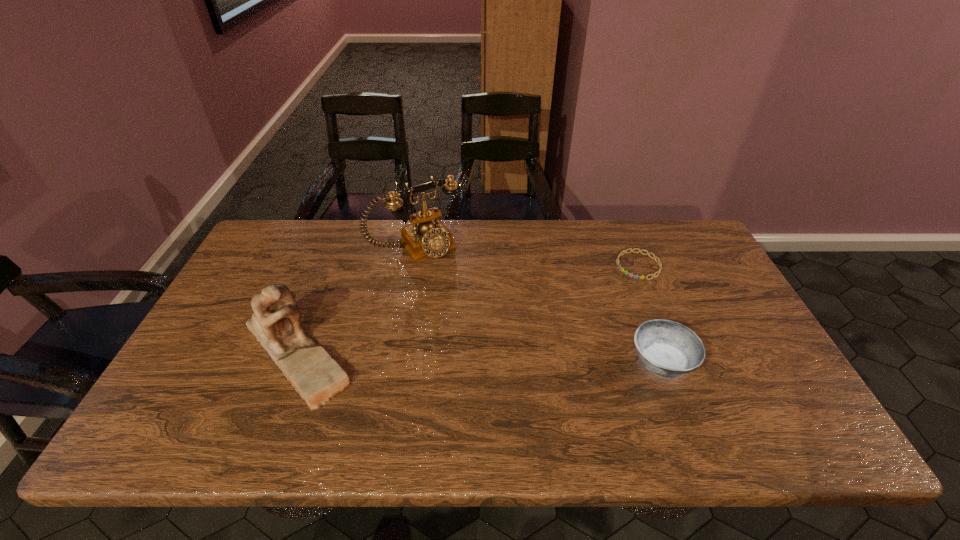
Find the location of a particular element. This screenshot has width=960, height=540. free area in between the telephone and the shortest object is located at coordinates (527, 255).

You are a GUI agent. You are given a task and a screenshot of the screen. Output one action in this format:
    pyautogui.click(x=<x>, y=<y>)
    Task: Click on the free spot between the ashtray and the figurine
    The height and width of the screenshot is (540, 960).
    Given the screenshot: What is the action you would take?
    pos(479,356)

In order to click on free space between the figurine and the telephone in this screenshot , I will do `click(356, 298)`.

The width and height of the screenshot is (960, 540). I want to click on free space between the telephone and the third tallest object, so click(539, 304).

This screenshot has width=960, height=540. Identify the location of vacant area that lies between the shortest object and the telephone. (527, 255).

Identify the location of vacant space that is in between the telephone and the bracelet. The image size is (960, 540). (527, 255).

You are a GUI agent. You are given a task and a screenshot of the screen. Output one action in this format:
    pyautogui.click(x=<x>, y=<y>)
    Task: Click on the free space between the bracelet and the figurine
    Image resolution: width=960 pixels, height=540 pixels.
    Given the screenshot: What is the action you would take?
    pyautogui.click(x=468, y=308)

Find the location of a particular element. The image size is (960, 540). vacant space that is in between the telephone and the ashtray is located at coordinates (x=539, y=304).

The width and height of the screenshot is (960, 540). Find the location of `free spot between the shortest object and the second shortest object`. free spot between the shortest object and the second shortest object is located at coordinates (650, 314).

Point out which object is positioned as the third nearest to the figurine. Please provide its 2D coordinates. Your answer should be formatted as a tuple, i.e. [(x, y)], where the tuple contains the x and y coordinates of a point satisfying the conditions above.

[(631, 275)]